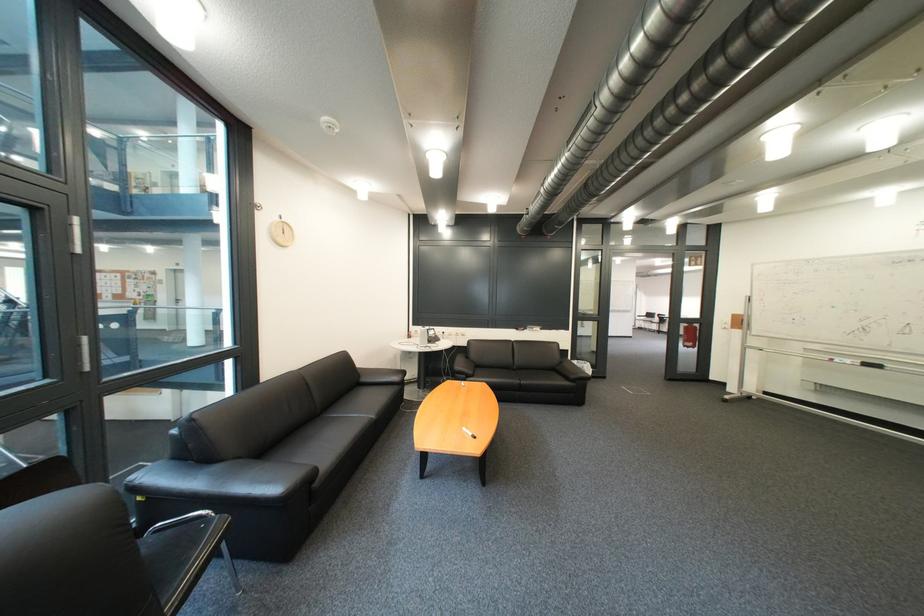
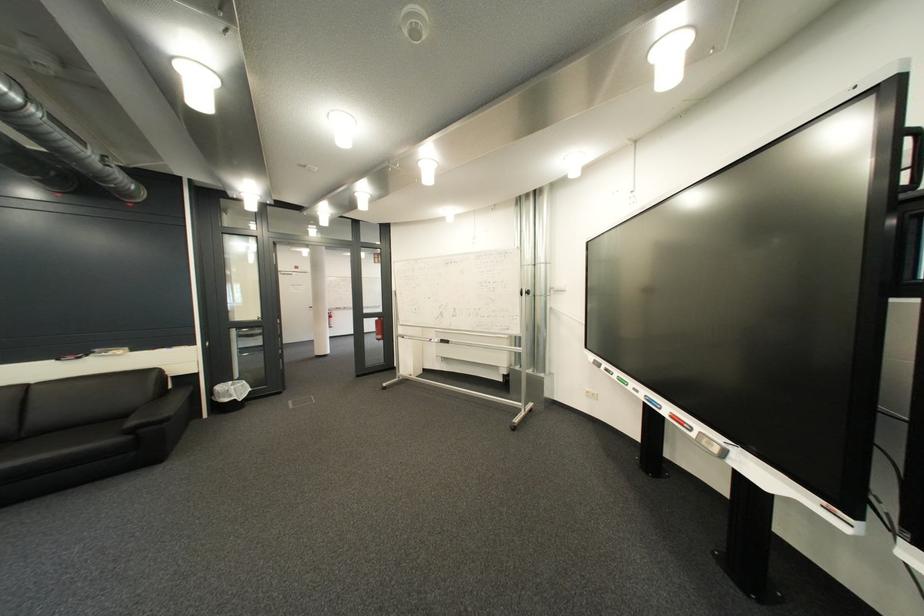
In the second image, find the point that corresponds to the point at 590,363 in the first image.

(245, 384)